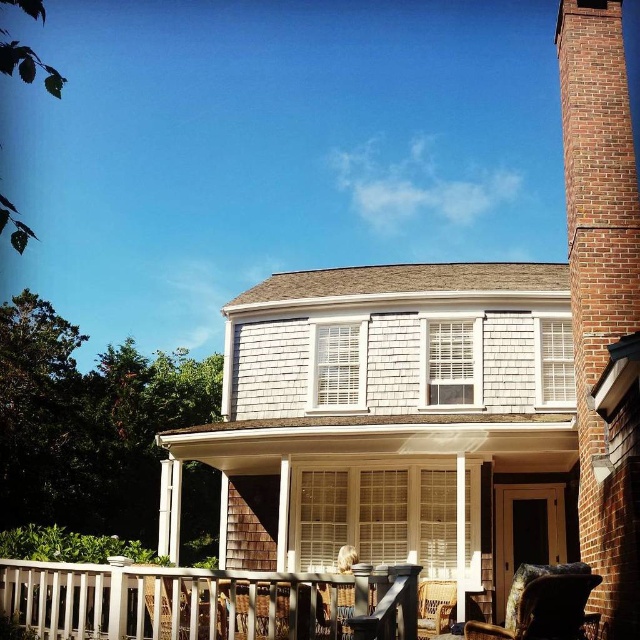
Question: Estimate the real-world distances between objects in this image. Which object is closer to the white wood porch at lower center?

Choices:
 (A) white shingles at center
 (B) wooden wicker chair at lower right
 (C) brick chimney at right
 (D) leather textured chair at lower right

Answer: (D)

Question: Which point is farther from the camera taking this photo?

Choices:
 (A) (435, 588)
 (B) (234, 614)
 (C) (572, 4)

Answer: (A)

Question: Is leather textured chair at lower right bigger than wooden wicker chair at lower right?

Choices:
 (A) yes
 (B) no

Answer: (A)

Question: Which of the following is the closest to the observer?

Choices:
 (A) (506, 275)
 (B) (234, 605)
 (C) (604, 561)
 (D) (532, 621)

Answer: (B)

Question: Is white shingles at center smaller than white wood porch at lower center?

Choices:
 (A) yes
 (B) no

Answer: (B)

Question: Does white shingles at center have a lesser width compared to leather textured chair at lower right?

Choices:
 (A) yes
 (B) no

Answer: (B)